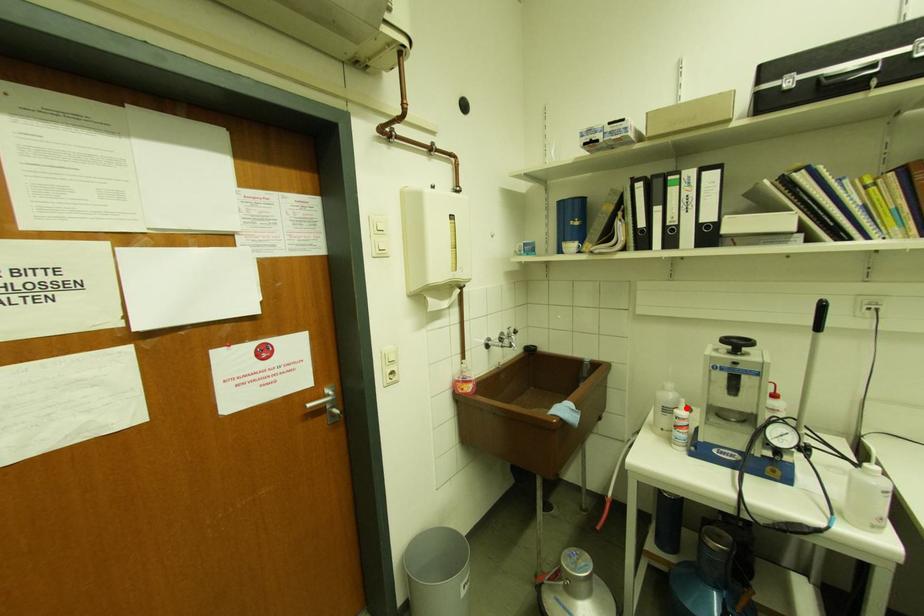
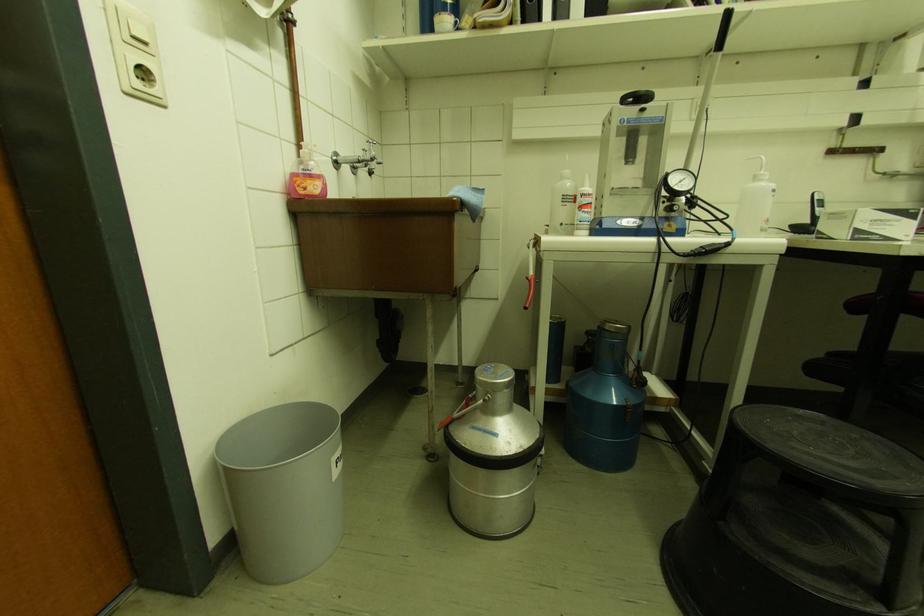
Where in the second image is the point corresponding to the highlighted location from the first image?

(590, 185)